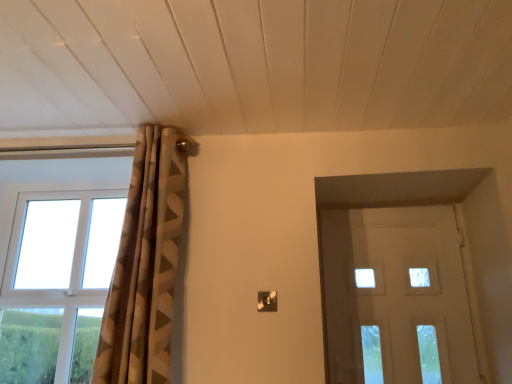
Measure the distance between point (152, 158) and camera.

The distance of point (152, 158) from camera is 2.02 meters.

Locate an element on the screen. brown textured curtain at upper left is located at coordinates (146, 264).

Between white frosted glass door at right and white plastic window at left, which one has smaller width?

With smaller width is white frosted glass door at right.

Considering the positions of objects white frosted glass door at right and white plastic window at left in the image provided, who is in front, white frosted glass door at right or white plastic window at left?

white frosted glass door at right is closer to the camera.

Consider the image. Is white frosted glass door at right bigger than white plastic window at left?

No.

Considering the positions of points (393, 333) and (98, 286), is point (393, 333) farther from camera compared to point (98, 286)?

No.

Considering the relative positions of brown textured curtain at upper left and white plastic window at left in the image provided, is brown textured curtain at upper left to the left of white plastic window at left from the viewer's perspective?

No.

Which object is wider, brown textured curtain at upper left or white plastic window at left?

Wider between the two is brown textured curtain at upper left.

From the image's perspective, is brown textured curtain at upper left beneath white plastic window at left?

Actually, brown textured curtain at upper left appears above white plastic window at left in the image.

From their relative heights in the image, would you say brown textured curtain at upper left is taller or shorter than white plastic window at left?

Considering their sizes, brown textured curtain at upper left has more height than white plastic window at left.

Considering the positions of objects white plastic window at left and white frosted glass door at right in the image provided, who is more to the left, white plastic window at left or white frosted glass door at right?

white plastic window at left is more to the left.

Is point (23, 183) positioned before point (441, 243)?

No, it is behind (441, 243).

Which of these two, white plastic window at left or white frosted glass door at right, stands taller?

Standing taller between the two is white plastic window at left.

Which is correct: white plastic window at left is inside white frosted glass door at right, or outside of it?

white plastic window at left cannot be found inside white frosted glass door at right.

From the image's perspective, is white frosted glass door at right beneath brown textured curtain at upper left?

Correct, white frosted glass door at right appears lower than brown textured curtain at upper left in the image.

Is point (417, 287) positioned in front of point (176, 209)?

That is False.

From a real-world perspective, is white frosted glass door at right located higher than brown textured curtain at upper left?

Incorrect, from a real-world perspective, white frosted glass door at right is lower than brown textured curtain at upper left.

Which of these two, white frosted glass door at right or brown textured curtain at upper left, stands taller?

brown textured curtain at upper left is taller.

Is brown textured curtain at upper left beside white frosted glass door at right?

No, brown textured curtain at upper left is not with white frosted glass door at right.

From a real-world perspective, is brown textured curtain at upper left above or below white frosted glass door at right?

From a real-world perspective, brown textured curtain at upper left is physically above white frosted glass door at right.

Between brown textured curtain at upper left and white frosted glass door at right, which one has smaller width?

white frosted glass door at right.

Does brown textured curtain at upper left lie in front of white frosted glass door at right?

Yes, the depth of brown textured curtain at upper left is less than that of white frosted glass door at right.

Consider the image. Between white plastic window at left and brown textured curtain at upper left, which one has more height?

Standing taller between the two is brown textured curtain at upper left.

Considering the points (95, 183) and (146, 312), which point is in front, point (95, 183) or point (146, 312)?

The point (146, 312) is closer.

Is white plastic window at left wider or thinner than brown textured curtain at upper left?

Clearly, white plastic window at left has less width compared to brown textured curtain at upper left.

From the image's perspective, relative to brown textured curtain at upper left, is white plastic window at left above or below?

From the image's perspective, white plastic window at left appears below brown textured curtain at upper left.

This screenshot has width=512, height=384. What are the coordinates of `door in front of the white plastic window at left` in the screenshot? It's located at (396, 297).

What are the coordinates of `window on the left of brown textured curtain at upper left` in the screenshot? It's located at (57, 260).

In the scene shown: Based on their spatial positions, is white frosted glass door at right or white plastic window at left closer to brown textured curtain at upper left?

white plastic window at left.

Consider the image. Which object lies nearer to the anchor point white frosted glass door at right, white plastic window at left or brown textured curtain at upper left?

The object closer to white frosted glass door at right is brown textured curtain at upper left.

Looking at the image, which one is located further to white frosted glass door at right, brown textured curtain at upper left or white plastic window at left?

white plastic window at left is further to white frosted glass door at right.

Which object lies nearer to the anchor point white plastic window at left, white frosted glass door at right or brown textured curtain at upper left?

brown textured curtain at upper left.

Looking at the image, which one is located closer to white plastic window at left, brown textured curtain at upper left or white frosted glass door at right?

brown textured curtain at upper left.

When comparing their distances from brown textured curtain at upper left, does white plastic window at left or white frosted glass door at right seem further?

The object further to brown textured curtain at upper left is white frosted glass door at right.

The height and width of the screenshot is (384, 512). Identify the location of curtain between white plastic window at left and white frosted glass door at right. (146, 264).